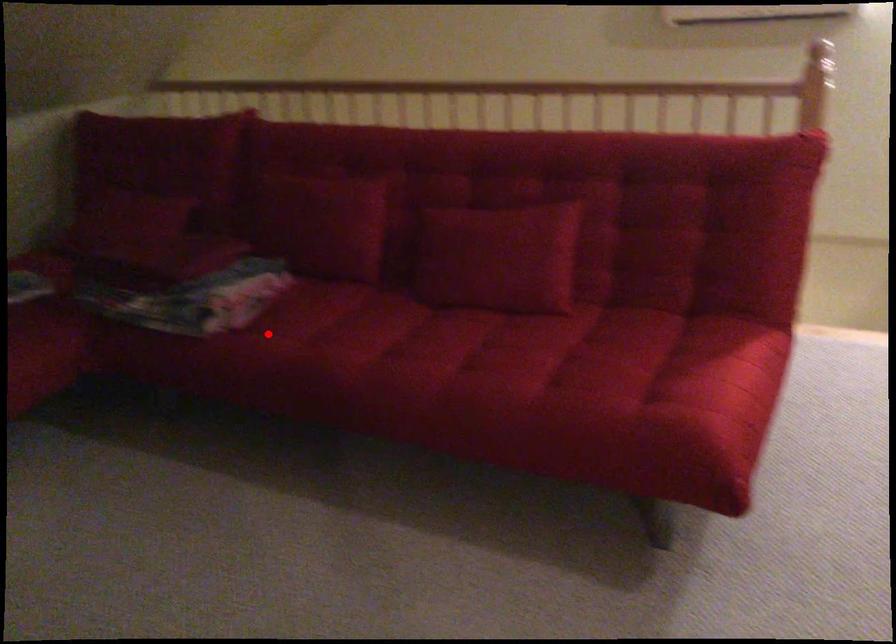
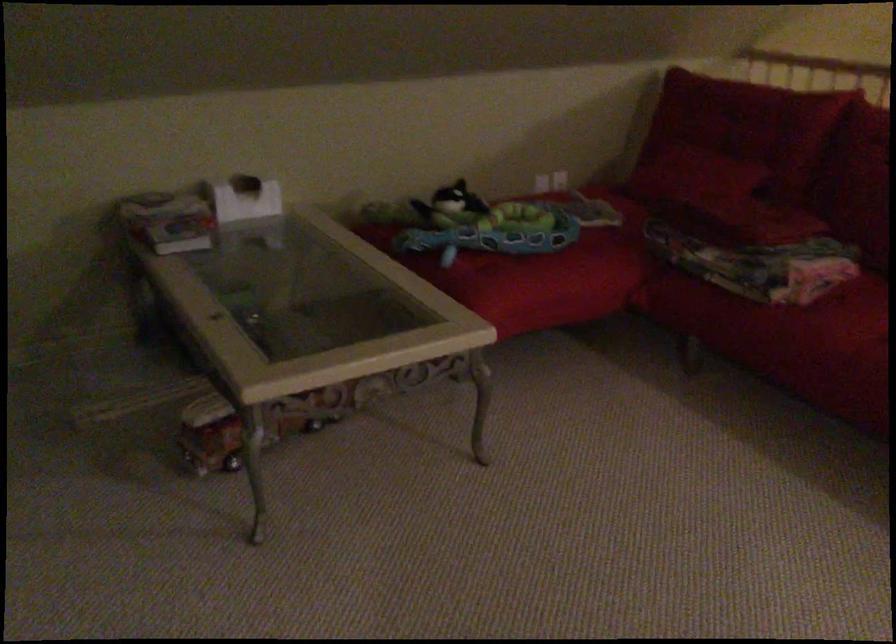
The point at the highlighted location is marked in the first image. Where is the corresponding point in the second image?

(843, 317)